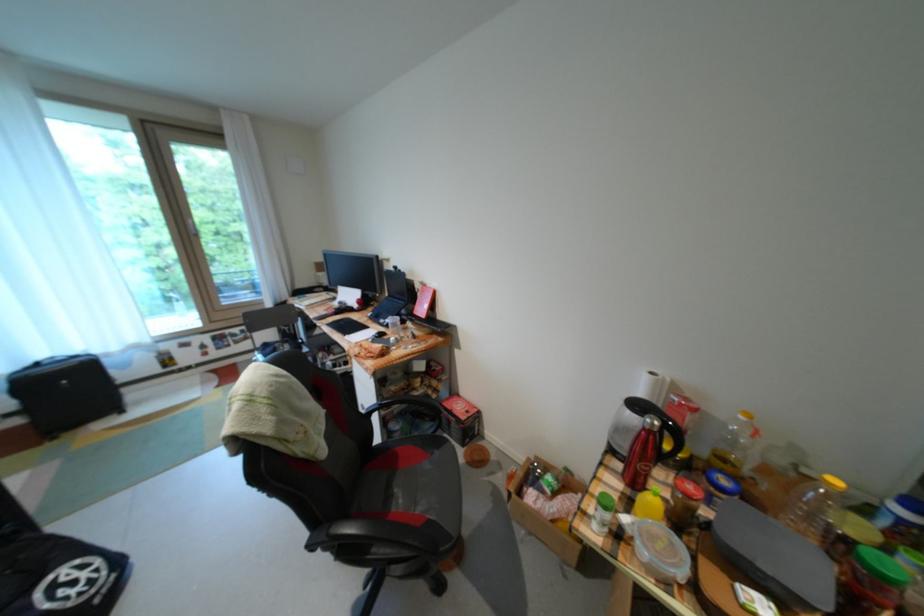
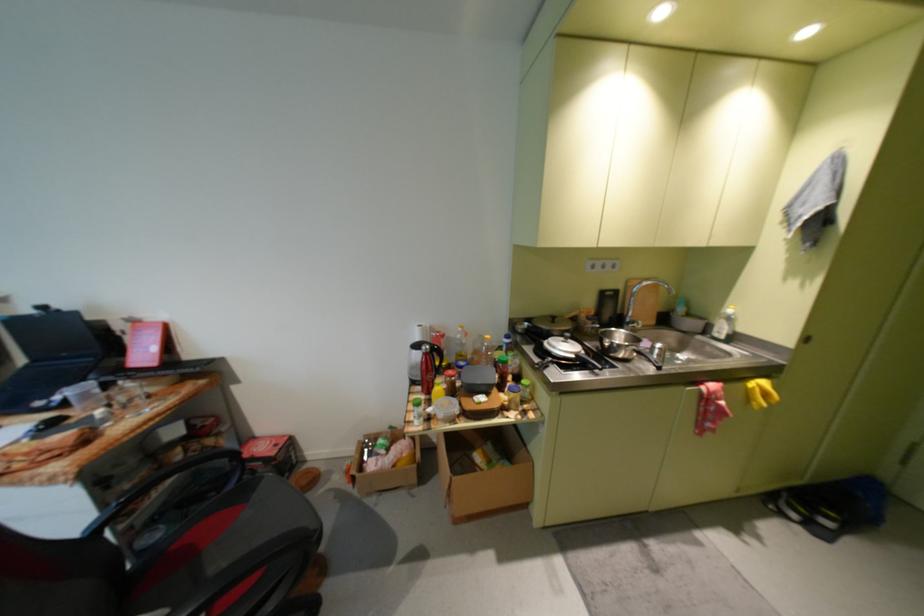
The point at (662, 438) is marked in the first image. Where is the corresponding point in the second image?

(439, 358)